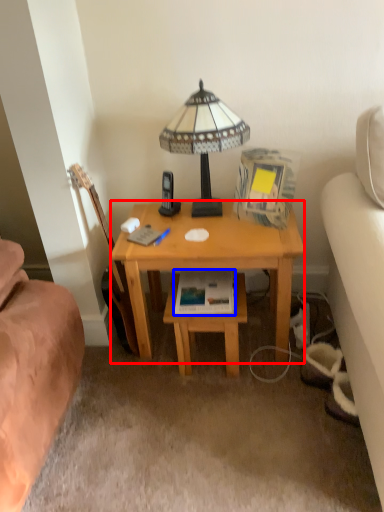
Question: Among these objects, which one is nearest to the camera, desk (highlighted by a red box) or paperback book (highlighted by a blue box)?

Choices:
 (A) desk
 (B) paperback book

Answer: (A)